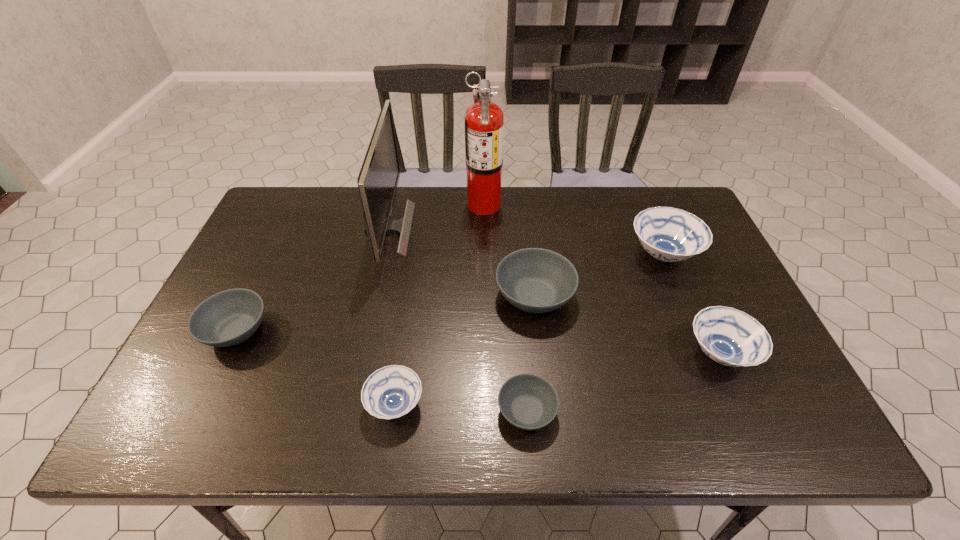
Where is `the leftmost blue soup bowl`? This screenshot has height=540, width=960. the leftmost blue soup bowl is located at coordinates (390, 392).

The height and width of the screenshot is (540, 960). In order to click on the nearest gray soup bowl in this screenshot , I will do `click(527, 401)`.

Find the location of a particular element. The image size is (960, 540). the shortest object is located at coordinates (527, 401).

I want to click on vacant region located on the nozzle side of the tallest object, so coord(354,204).

Identify the location of free space located 0.380m on the nozzle side of the tallest object. The image size is (960, 540). (351, 204).

The width and height of the screenshot is (960, 540). In order to click on blank space located 0.260m on the nozzle side of the tallest object in this screenshot , I will do `click(388, 204)`.

Identify the location of vacant space located on the screen side of the monitor. (443, 228).

Locate an element on the screen. vacant region located on the front of the biggest blue soup bowl is located at coordinates point(712,372).

You are a GUI agent. You are given a task and a screenshot of the screen. Output one action in this format:
    pyautogui.click(x=<x>, y=<y>)
    Task: Click on the vacant space situated on the left of the biggest gray soup bowl
    The image size is (960, 540).
    Given the screenshot: What is the action you would take?
    pyautogui.click(x=348, y=296)

Where is `vacant point located on the left of the second smallest blue soup bowl`? vacant point located on the left of the second smallest blue soup bowl is located at coordinates [x=600, y=354].